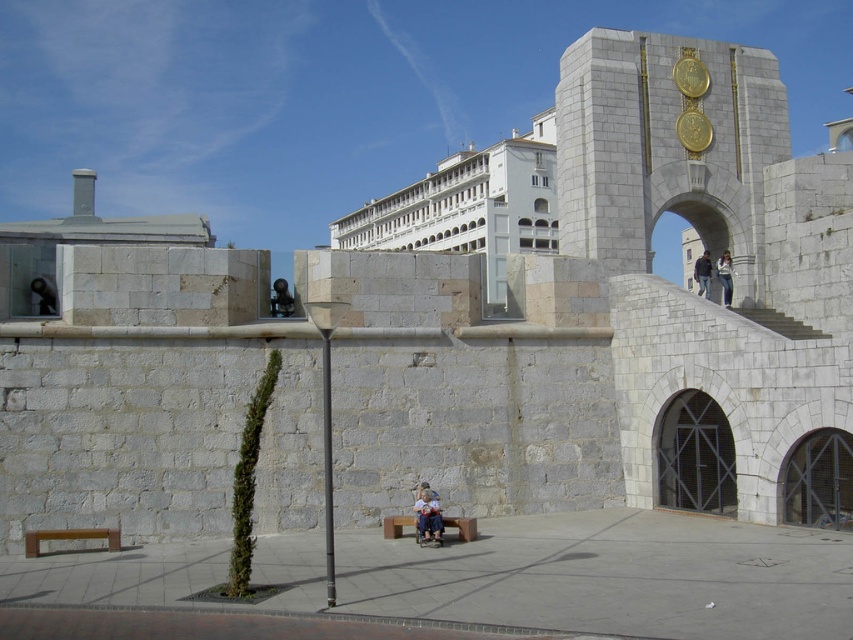
Question: Can you confirm if wooden bench at lower left is positioned to the right of dark blue jeans at upper right?

Choices:
 (A) no
 (B) yes

Answer: (A)

Question: Which of these objects is positioned farthest from the dark blue jeans at upper right?

Choices:
 (A) wooden bench at lower left
 (B) red wooden bench at lower center

Answer: (A)

Question: From the image, what is the correct spatial relationship of wooden bench at lower left in relation to red wooden bench at lower center?

Choices:
 (A) above
 (B) below

Answer: (B)

Question: Which is nearer to the dark blue jeans at upper right?

Choices:
 (A) light blue denim jeans at center
 (B) wooden bench at lower left

Answer: (A)

Question: In this image, where is wooden bench at lower left located relative to light blue denim jeans at center?

Choices:
 (A) below
 (B) above

Answer: (A)

Question: Which of the following is the closest to the observer?

Choices:
 (A) (393, 518)
 (B) (25, 550)

Answer: (B)